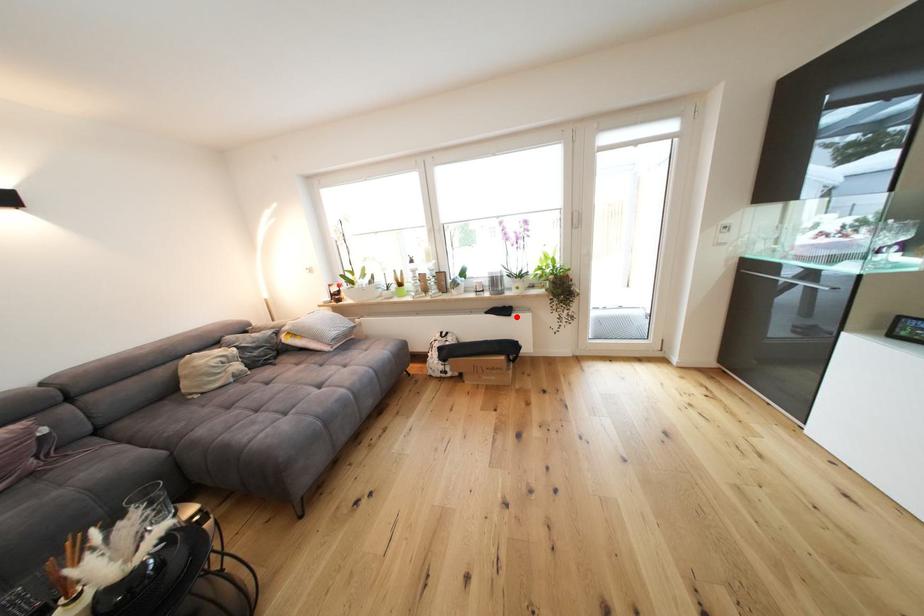
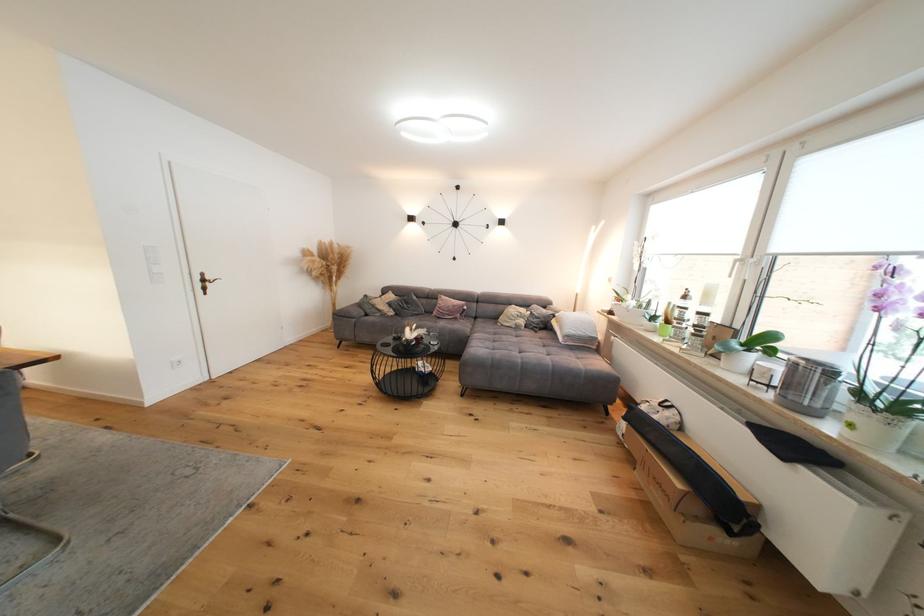
Locate, in the second image, the point that corresponds to the highlighted location in the first image.

(793, 461)